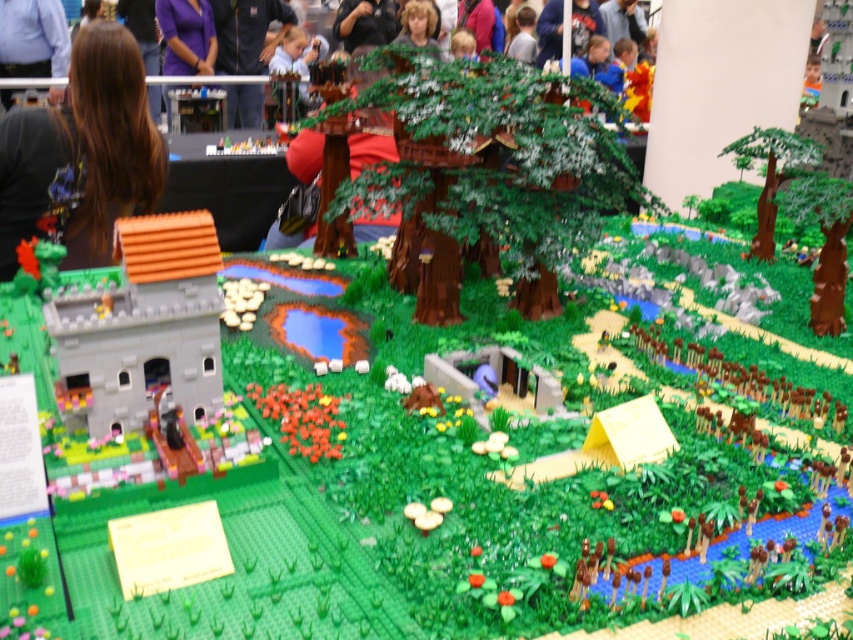
You are a photographer taking a picture of the brown hair at upper left and the brown textured tree at right. Which object should you focus on first if you want to capture both in sharp focus?

The brown textured tree at right is further away from the camera than the brown hair at upper left, so you should focus on the brown textured tree at right first to ensure both are in sharp focus.

What are the coordinates of the green matte tree at center?

The green matte tree at center is located at point (490, 173).